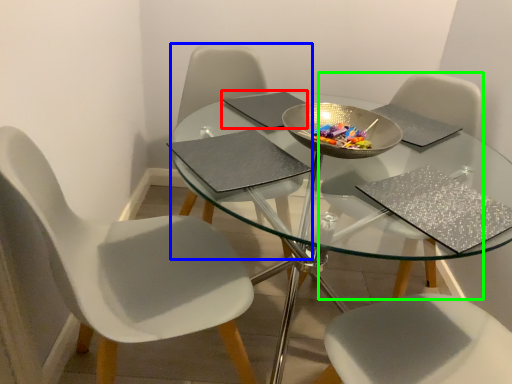
Question: Which object is the closest to the pad (highlighted by a red box)? Choose among these: chair (highlighted by a blue box) or chair (highlighted by a green box).

Choices:
 (A) chair
 (B) chair

Answer: (A)